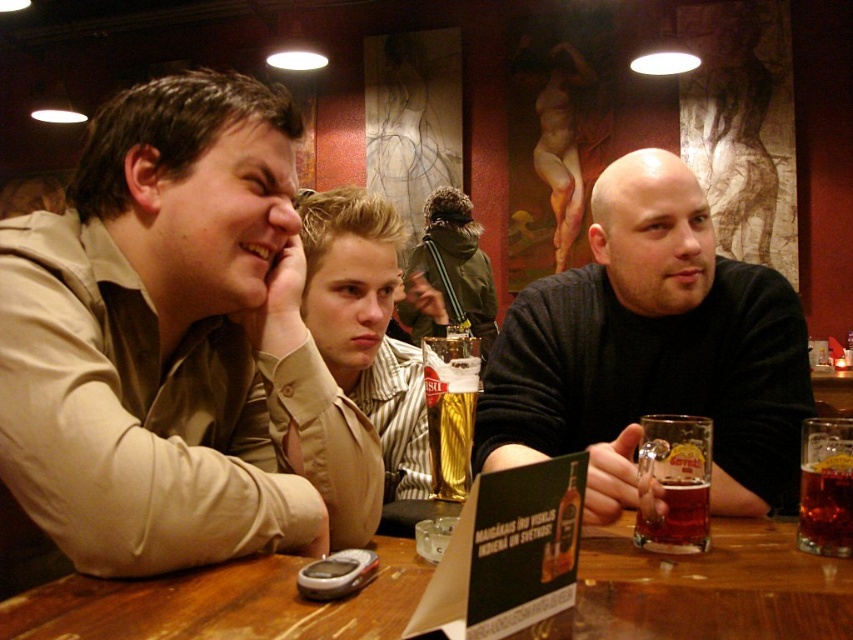
Is brown glass beer at table center behind translucent glass mug at table center?

No, it is in front of translucent glass mug at table center.

Between brown glass beer at table center and translucent glass mug at table center, which one is positioned higher?

brown glass beer at table center is above.

Is point (802, 428) farther from viewer compared to point (683, 500)?

Yes.

You are a GUI agent. You are given a task and a screenshot of the screen. Output one action in this format:
    pyautogui.click(x=<x>, y=<y>)
    Task: Click on the brown glass beer at table center
    
    Given the screenshot: What is the action you would take?
    pyautogui.click(x=825, y=486)

Can you confirm if matte khaki shirt at left is bigger than brown glass beer at table center?

Indeed, matte khaki shirt at left has a larger size compared to brown glass beer at table center.

Does matte khaki shirt at left have a lesser height compared to brown glass beer at table center?

No.

Does point (184, 541) lie in front of point (833, 525)?

Yes, point (184, 541) is closer to viewer.

Locate an element on the screen. matte khaki shirt at left is located at coordinates (177, 346).

Between point (241, 502) and point (659, 625), which one is positioned behind?

Point (241, 502)

Which of these two, matte khaki shirt at left or wooden table at center, stands shorter?

Standing shorter between the two is wooden table at center.

Who is more distant from viewer, (193,396) or (780,560)?

The point (193,396) is behind.

Where is `matte khaki shirt at left`? The image size is (853, 640). matte khaki shirt at left is located at coordinates (177, 346).